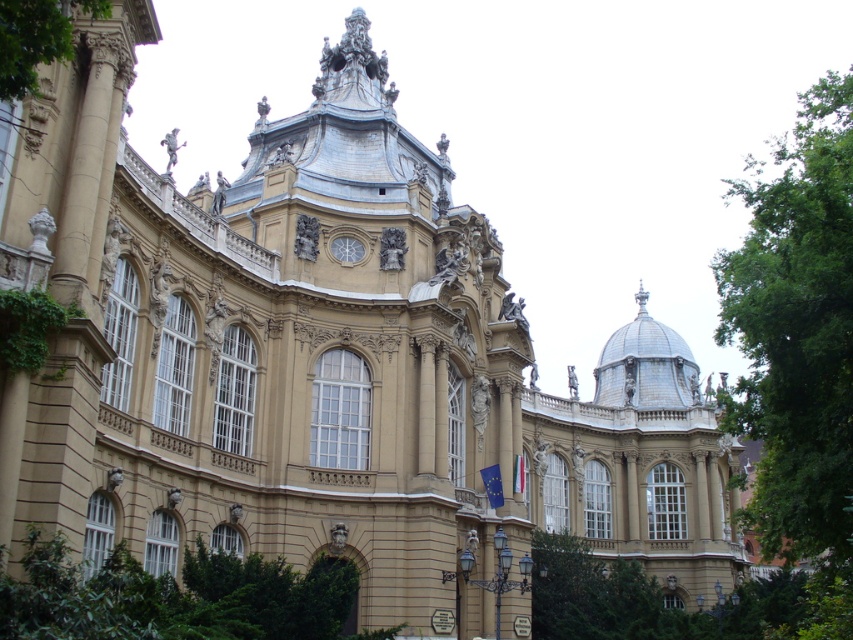
Describe the element at coordinates (172, 596) in the screenshot. The width and height of the screenshot is (853, 640). I see `green leafy tree at lower center` at that location.

Does green leafy tree at lower center have a larger size compared to green leafy tree at upper left?

Yes.

Image resolution: width=853 pixels, height=640 pixels. Describe the element at coordinates (172, 596) in the screenshot. I see `green leafy tree at lower center` at that location.

Identify the location of green leafy tree at lower center. (172, 596).

Is green leafy tree at right closer to the viewer compared to green leafy tree at lower center?

That is False.

Between green leafy tree at right and green leafy tree at lower center, which one appears on the left side from the viewer's perspective?

From the viewer's perspective, green leafy tree at lower center appears more on the left side.

At what (x,y) coordinates should I click in order to perform the action: click on green leafy tree at right. Please return your answer as a coordinate pair (x, y). Looking at the image, I should click on [798, 328].

Who is shorter, green leafy tree at right or green leafy tree at lower right?

With less height is green leafy tree at lower right.

Who is more distant from viewer, (x=766, y=333) or (x=553, y=611)?

Positioned behind is point (x=553, y=611).

Identify the location of green leafy tree at right. (798, 328).